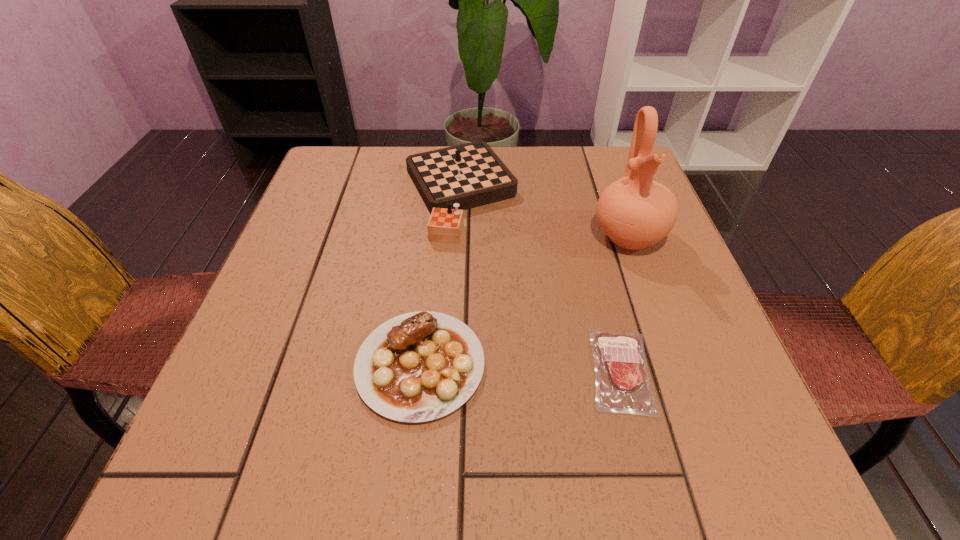
The image size is (960, 540). I want to click on free space between the right steak and the pottery, so click(624, 303).

Where is `free point between the third shortest object and the tallest object`? This screenshot has width=960, height=540. free point between the third shortest object and the tallest object is located at coordinates (544, 214).

This screenshot has width=960, height=540. Identify the location of free space between the left steak and the tallest object. (524, 300).

Image resolution: width=960 pixels, height=540 pixels. What are the coordinates of `empty space between the shortest object and the left steak` in the screenshot? It's located at [x=520, y=368].

What are the coordinates of `free point between the shortest object and the third shortest object` in the screenshot? It's located at (540, 282).

This screenshot has height=540, width=960. I want to click on free space between the right steak and the tallest object, so click(624, 303).

The height and width of the screenshot is (540, 960). In order to click on empty space that is in between the tallest object and the third tallest object in this screenshot , I will do `click(524, 300)`.

Image resolution: width=960 pixels, height=540 pixels. What are the coordinates of `free spot between the right steak and the tallest object` in the screenshot? It's located at (624, 303).

I want to click on vacant space in between the left steak and the chessboard, so click(440, 279).

You are a GUI agent. You are given a task and a screenshot of the screen. Output one action in this format:
    pyautogui.click(x=<x>, y=<y>)
    Task: Click on the second closest object to the third shortest object
    
    Given the screenshot: What is the action you would take?
    pyautogui.click(x=420, y=366)